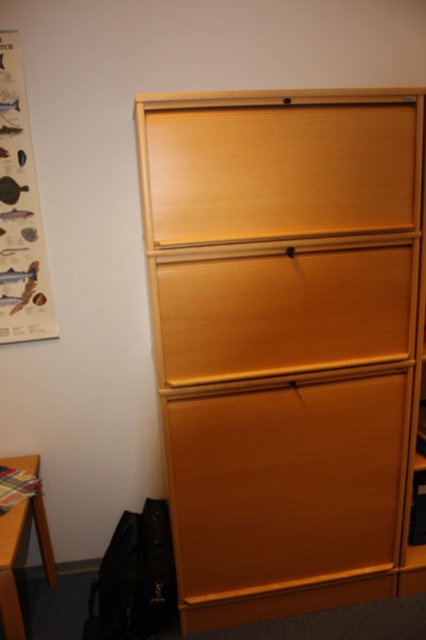
You are organizing a workspace and need to place a new plant pot that is 0.3 meters wide. The plant pot must be placed on the wooden table to the left of the light wood dresser at center. Is there enough space on the table for the plant pot?

The light wood dresser at center is located at point (285, 340). Since the table is to the left of the dresser and the plant pot is 0.3 meters wide, there is sufficient space on the table for the plant pot as long as the table has enough width. However, the exact dimensions of the table are not provided, so we cannot confirm with certainty.

You are standing in front of the wooden filing cabinet and want to place a small potted plant. The plant requires a space that is 0.5 meters wide. Can the point at coordinates (285,340) accommodate the plant?

The point at coordinates (285,340) indicates the light wood dresser at center. Since the dresser is a single point, it does not have a width. Therefore, the plant cannot be placed there as it requires a 0.5 meters wide space.